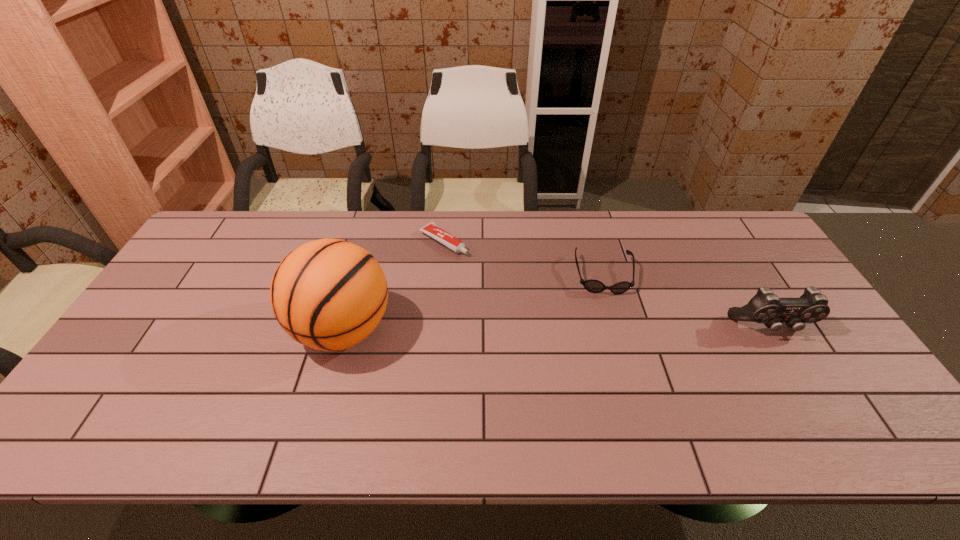
Find the location of a particular element. the leftmost object is located at coordinates click(329, 294).

At what (x,y) coordinates should I click in order to perform the action: click on basketball. Please return your answer as a coordinate pair (x, y). This screenshot has height=540, width=960. Looking at the image, I should click on (329, 294).

Where is `the rightmost object`? The image size is (960, 540). the rightmost object is located at coordinates (765, 307).

The height and width of the screenshot is (540, 960). I want to click on control, so click(765, 307).

This screenshot has width=960, height=540. What are the coordinates of `sunglasses` in the screenshot? It's located at (594, 286).

At what (x,y) coordinates should I click in order to perform the action: click on the second shortest object. Please return your answer as a coordinate pair (x, y). The width and height of the screenshot is (960, 540). Looking at the image, I should click on (594, 286).

The height and width of the screenshot is (540, 960). Find the location of `the second object from left to right`. the second object from left to right is located at coordinates (431, 229).

Find the location of a particular element. The height and width of the screenshot is (540, 960). toothpaste is located at coordinates (431, 229).

Locate an element on the screen. The height and width of the screenshot is (540, 960). vacant space located on the right of the leftmost object is located at coordinates (416, 329).

Where is `vacant region located 0.110m on the surface of the second tallest object with buttons`? vacant region located 0.110m on the surface of the second tallest object with buttons is located at coordinates (802, 377).